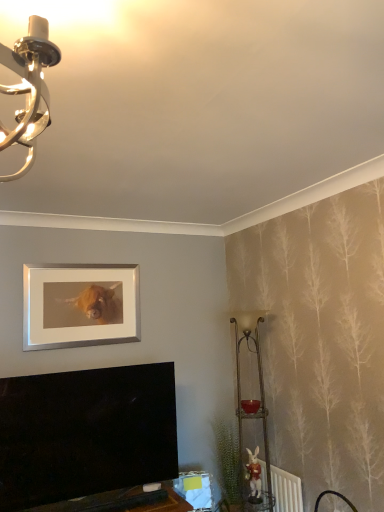
At what (x,y) coordinates should I click in order to perform the action: click on silver/metallic picture frame at upper center. Please return your answer as a coordinate pair (x, y). This screenshot has width=384, height=512. Looking at the image, I should click on (80, 305).

This screenshot has width=384, height=512. What do you see at coordinates (226, 459) in the screenshot? I see `green leafy plant at lower right` at bounding box center [226, 459].

Identify the location of green leafy plant at lower right. The image size is (384, 512). (226, 459).

I want to click on metallic gold table lamp at right, so click(251, 400).

Does silver/metallic picture frame at upper center have a lesser width compared to metallic gold table lamp at right?

Indeed, silver/metallic picture frame at upper center has a lesser width compared to metallic gold table lamp at right.

Is silver/metallic picture frame at upper center looking in the opposite direction of metallic gold table lamp at right?

That's not correct — silver/metallic picture frame at upper center is not looking away from metallic gold table lamp at right.

From the image's perspective, relative to metallic gold table lamp at right, is silver/metallic picture frame at upper center above or below?

From the image's perspective, silver/metallic picture frame at upper center appears above metallic gold table lamp at right.

Where is `table lamp that is on the right side of silver/metallic picture frame at upper center`? The image size is (384, 512). table lamp that is on the right side of silver/metallic picture frame at upper center is located at coordinates (251, 400).

Locate an element on the screen. The image size is (384, 512). plant below the metallic gold table lamp at right (from the image's perspective) is located at coordinates (226, 459).

Are green leafy plant at lower right and metallic gold table lamp at right making contact?

No, green leafy plant at lower right is not next to metallic gold table lamp at right.

Does point (220, 419) lie in front of point (245, 336)?

No, (220, 419) is behind (245, 336).

Is green leafy plant at lower right facing towards metallic gold table lamp at right?

Yes, green leafy plant at lower right is aimed at metallic gold table lamp at right.

Which object is closer to the camera, silver/metallic picture frame at upper center or green leafy plant at lower right?

silver/metallic picture frame at upper center is more forward.

Is silver/metallic picture frame at upper center touching green leafy plant at lower right?

No.

Does silver/metallic picture frame at upper center turn towards green leafy plant at lower right?

No, silver/metallic picture frame at upper center is not facing towards green leafy plant at lower right.

In the scene shown: Would you say green leafy plant at lower right is part of silver/metallic picture frame at upper center's contents?

No, green leafy plant at lower right is not inside silver/metallic picture frame at upper center.

Considering the sizes of green leafy plant at lower right and silver/metallic picture frame at upper center in the image, is green leafy plant at lower right taller or shorter than silver/metallic picture frame at upper center?

Considering their sizes, green leafy plant at lower right has more height than silver/metallic picture frame at upper center.

Who is more distant, green leafy plant at lower right or silver/metallic picture frame at upper center?

green leafy plant at lower right is more distant.

Does green leafy plant at lower right have a larger size compared to silver/metallic picture frame at upper center?

Yes, green leafy plant at lower right is bigger than silver/metallic picture frame at upper center.

From the image's perspective, who appears lower, green leafy plant at lower right or silver/metallic picture frame at upper center?

green leafy plant at lower right appears lower in the image.

Locate an element on the screen. radiator lying below the green leafy plant at lower right (from the image's perspective) is located at coordinates (286, 490).

Is white plastic radiator at lower right located within green leafy plant at lower right?

Actually, white plastic radiator at lower right is outside green leafy plant at lower right.

From the image's perspective, is green leafy plant at lower right over white plastic radiator at lower right?

Yes, from the image's perspective, green leafy plant at lower right is over white plastic radiator at lower right.

Can you confirm if green leafy plant at lower right is taller than white plastic radiator at lower right?

Correct, green leafy plant at lower right is much taller as white plastic radiator at lower right.

Is white plastic radiator at lower right far away from silver/metallic picture frame at upper center?

Indeed, white plastic radiator at lower right is not near silver/metallic picture frame at upper center.

From the image's perspective, which object appears higher, white plastic radiator at lower right or silver/metallic picture frame at upper center?

silver/metallic picture frame at upper center.

Considering the sizes of white plastic radiator at lower right and silver/metallic picture frame at upper center in the image, is white plastic radiator at lower right taller or shorter than silver/metallic picture frame at upper center?

Clearly, white plastic radiator at lower right is shorter compared to silver/metallic picture frame at upper center.

Which is behind, point (292, 511) or point (100, 338)?

Positioned behind is point (100, 338).

Which object is further away from the camera, metallic gold table lamp at right or green leafy plant at lower right?

green leafy plant at lower right is further from the camera.

Consider the image. Which of these two, metallic gold table lamp at right or green leafy plant at lower right, stands taller?

Standing taller between the two is metallic gold table lamp at right.

Which is more distant, (240,403) or (237,501)?

The point (240,403) is behind.

This screenshot has width=384, height=512. What are the coordinates of `table lamp that appears on the right of silver/metallic picture frame at upper center` in the screenshot? It's located at (251, 400).

At what (x,y) coordinates should I click in order to perform the action: click on plant on the left of metallic gold table lamp at right. Please return your answer as a coordinate pair (x, y). This screenshot has height=512, width=384. Looking at the image, I should click on (226, 459).

Considering their positions, is green leafy plant at lower right positioned closer to silver/metallic picture frame at upper center than white plastic radiator at lower right?

Based on the image, green leafy plant at lower right appears to be nearer to silver/metallic picture frame at upper center.

Considering their positions, is white plastic radiator at lower right positioned closer to metallic gold table lamp at right than silver/metallic picture frame at upper center?

Based on the image, white plastic radiator at lower right appears to be nearer to metallic gold table lamp at right.

Which object lies nearer to the anchor point white plastic radiator at lower right, metallic gold table lamp at right or silver/metallic picture frame at upper center?

Based on the image, metallic gold table lamp at right appears to be nearer to white plastic radiator at lower right.

Looking at the image, which one is located closer to silver/metallic picture frame at upper center, white plastic radiator at lower right or green leafy plant at lower right?

The object closer to silver/metallic picture frame at upper center is green leafy plant at lower right.

When comparing their distances from white plastic radiator at lower right, does silver/metallic picture frame at upper center or metallic gold table lamp at right seem closer?

metallic gold table lamp at right.

Based on their spatial positions, is green leafy plant at lower right or silver/metallic picture frame at upper center closer to metallic gold table lamp at right?

Among the two, green leafy plant at lower right is located nearer to metallic gold table lamp at right.

From the image, which object appears to be farther from green leafy plant at lower right, white plastic radiator at lower right or metallic gold table lamp at right?

The object further to green leafy plant at lower right is white plastic radiator at lower right.

Based on their spatial positions, is metallic gold table lamp at right or white plastic radiator at lower right further from silver/metallic picture frame at upper center?

Among the two, white plastic radiator at lower right is located further to silver/metallic picture frame at upper center.

At what (x,y) coordinates should I click in order to perform the action: click on plant between metallic gold table lamp at right and white plastic radiator at lower right from top to bottom. Please return your answer as a coordinate pair (x, y). Looking at the image, I should click on (226, 459).

This screenshot has height=512, width=384. What are the coordinates of `table lamp between silver/metallic picture frame at upper center and white plastic radiator at lower right from left to right` in the screenshot? It's located at [251, 400].

Locate an element on the screen. The width and height of the screenshot is (384, 512). plant between silver/metallic picture frame at upper center and metallic gold table lamp at right from left to right is located at coordinates (226, 459).

Locate an element on the screen. plant between silver/metallic picture frame at upper center and white plastic radiator at lower right in the vertical direction is located at coordinates (226, 459).